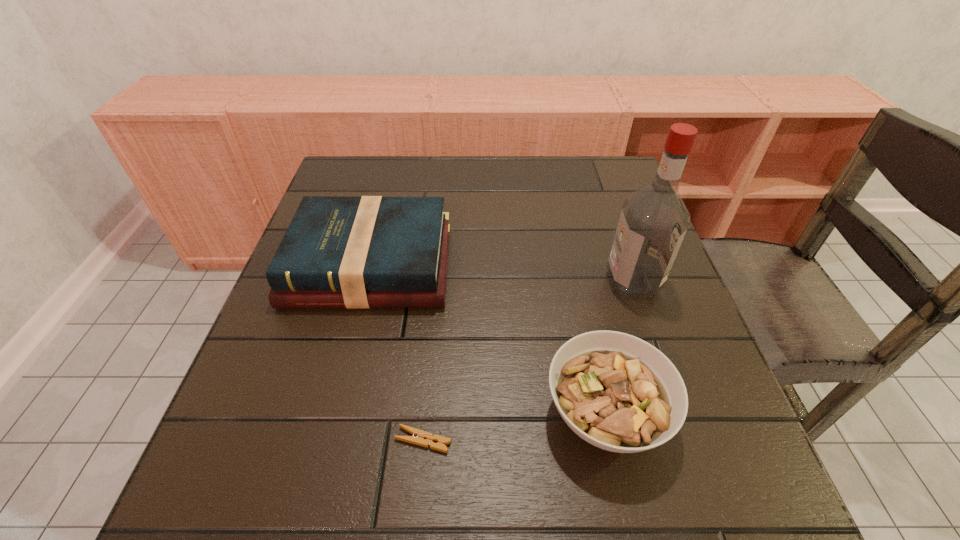
Where is `object that is at the near edge`? object that is at the near edge is located at coordinates point(617,392).

Identify the location of object located in the left edge section of the desktop. The height and width of the screenshot is (540, 960). (365, 252).

In order to click on liquor present at the right edge in this screenshot , I will do `click(654, 219)`.

Where is `stew that is at the right edge`? This screenshot has height=540, width=960. stew that is at the right edge is located at coordinates (617, 392).

Where is `object that is at the near right corner`? This screenshot has height=540, width=960. object that is at the near right corner is located at coordinates (617, 392).

You are a GUI agent. You are given a task and a screenshot of the screen. Output one action in this format:
    pyautogui.click(x=<x>, y=<y>)
    Task: Click on the blank space at the far edge
    This screenshot has width=960, height=540.
    Given the screenshot: What is the action you would take?
    pyautogui.click(x=446, y=201)

Identify the location of vacant area at the near edge. Image resolution: width=960 pixels, height=540 pixels. (440, 478).

The width and height of the screenshot is (960, 540). In the image, there is a desktop. In order to click on vacant space at the left edge in this screenshot , I will do `click(271, 315)`.

The image size is (960, 540). Identify the location of free space at the right edge of the desktop. (613, 222).

Find the location of a particular element. This screenshot has height=540, width=960. vacant area at the far left corner is located at coordinates (341, 183).